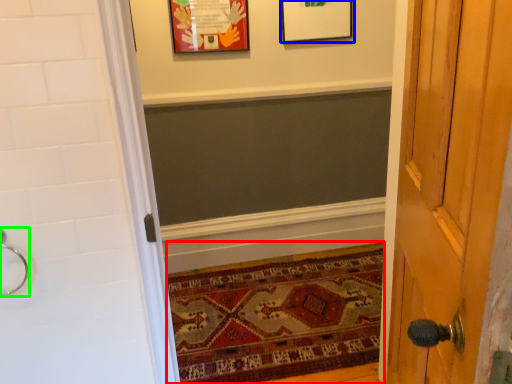
Question: Estimate the real-world distances between objects in this image. Which object is farther from mat (highlighted by a red box), picture frame (highlighted by a blue box) or door handle (highlighted by a green box)?

Choices:
 (A) picture frame
 (B) door handle

Answer: (A)